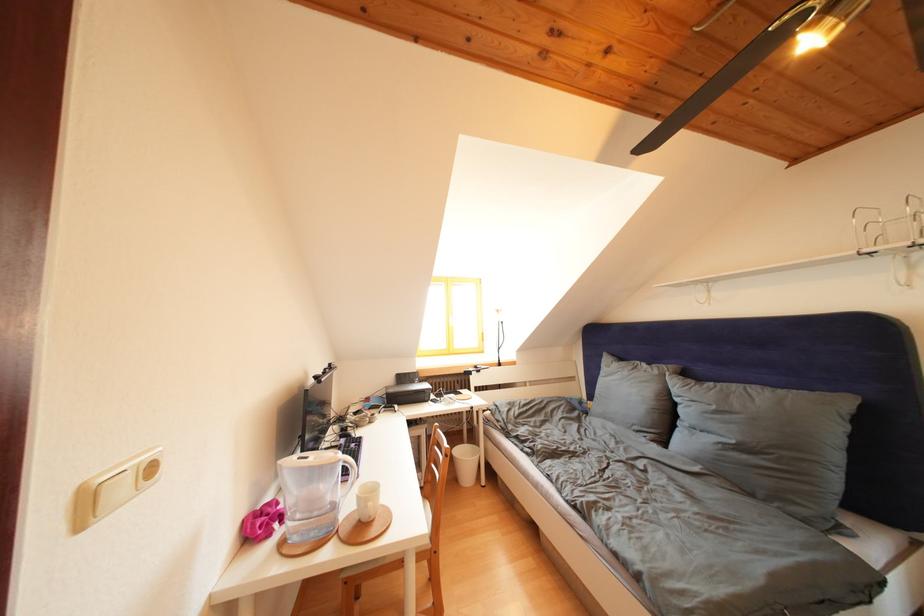
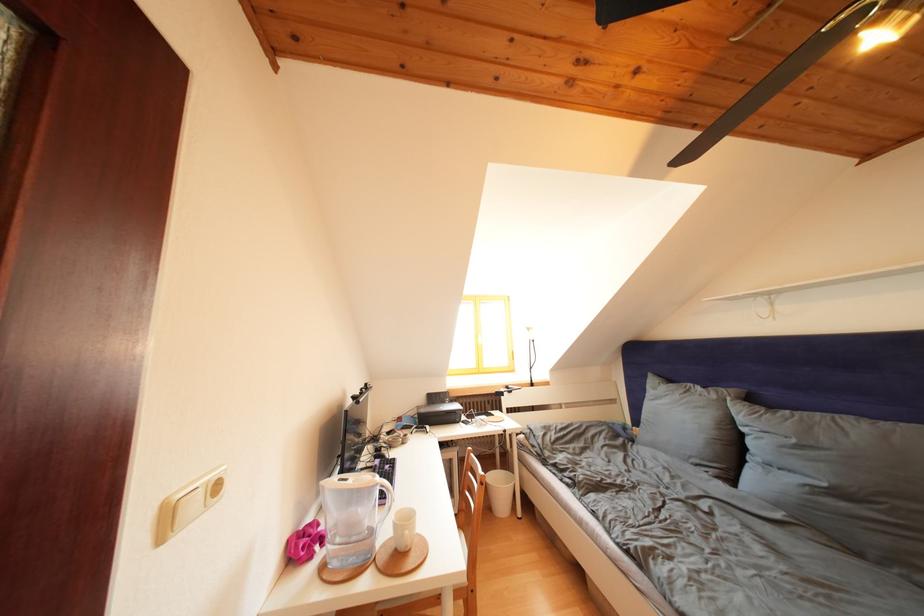
Where in the second image is the point corresponding to (x=722, y=411) from the first image?

(801, 446)